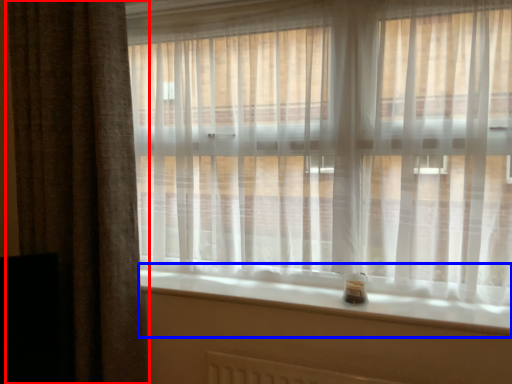
Question: Which of the following is the farthest to the observer, curtain (highlighted by a red box) or window sill (highlighted by a blue box)?

Choices:
 (A) curtain
 (B) window sill

Answer: (A)